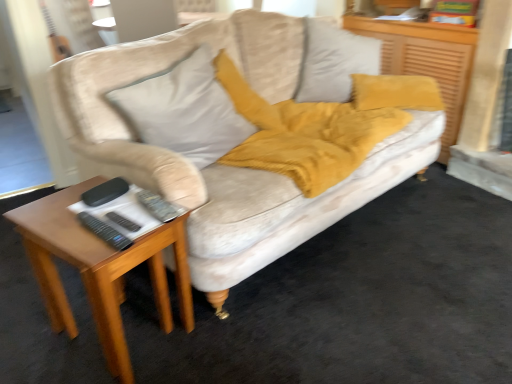
Identify the location of vacant space situated on the left part of woodenmaterial/texturetable at left. (28, 334).